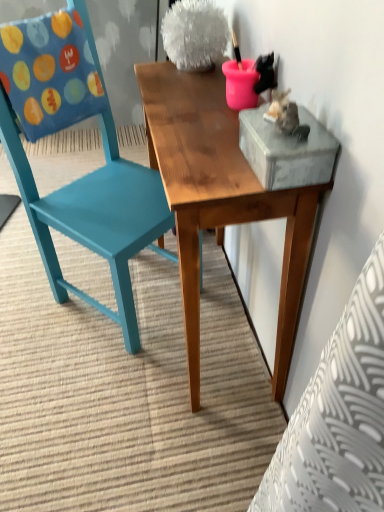
Locate an element on the screen. Image resolution: width=384 pixels, height=512 pixels. free location in front of wooden table at center is located at coordinates (152, 436).